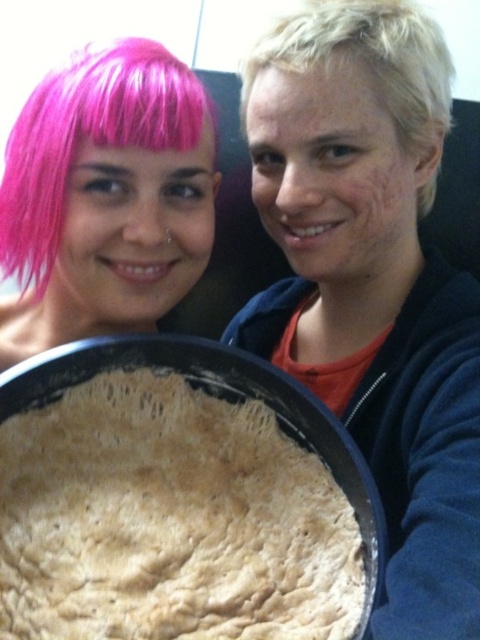
Is point (278, 524) positioned before point (283, 28)?

Yes, it is.

Is brown crumbly dough at center smaller than blondehair at right?

No.

This screenshot has width=480, height=640. Describe the element at coordinates (169, 518) in the screenshot. I see `brown crumbly dough at center` at that location.

You are a GUI agent. You are given a task and a screenshot of the screen. Output one action in this format:
    pyautogui.click(x=<x>, y=<y>)
    Task: Click on the brown crumbly dough at center
    
    Given the screenshot: What is the action you would take?
    pyautogui.click(x=169, y=518)

At what (x,y) coordinates should I click in order to perform the action: click on baked dough at center. Please return your answer as a coordinate pair (x, y). Looking at the image, I should click on (372, 282).

Is baked dough at center smaller than pink matte wig at upper left?

Incorrect, baked dough at center is not smaller in size than pink matte wig at upper left.

This screenshot has height=640, width=480. What do you see at coordinates (372, 282) in the screenshot?
I see `baked dough at center` at bounding box center [372, 282].

This screenshot has height=640, width=480. Identify the location of baked dough at center. (372, 282).

Is point (336, 264) closer to camera compared to point (382, 99)?

No.

Does baked dough at center appear under blondehair at right?

Correct, baked dough at center is located below blondehair at right.

The height and width of the screenshot is (640, 480). Describe the element at coordinates (372, 282) in the screenshot. I see `baked dough at center` at that location.

At what (x,y) coordinates should I click in order to perform the action: click on baked dough at center. Please return your answer as a coordinate pair (x, y). Looking at the image, I should click on (372, 282).